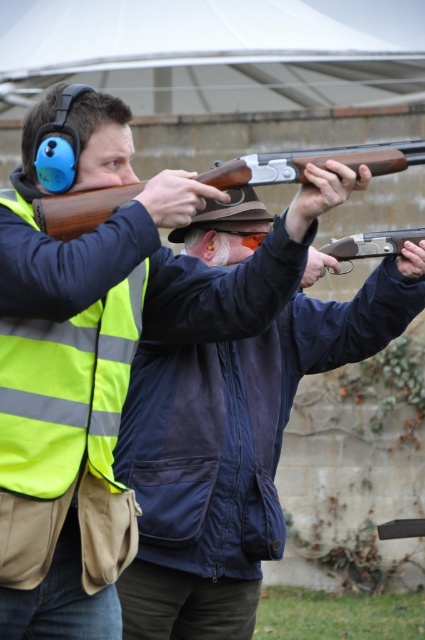
You are a safety officer standing at the shooting range. You see the matte brown shotgun at center. Can you safely retrieve it without entering the danger zone, which extends 25 meters from the firing line?

The matte brown shotgun at center is 28.43 meters away from viewer. Since the danger zone extends 25 meters from the firing line, retrieving it would require entering the danger zone, so it is not safe to retrieve it without proper clearance.

You are a safety officer at a shooting range. You need to ensure that all firearms are at least 6 meters apart for safety regulations. You see the wooden shotgun at center and the matte brown shotgun at upper center. Are they compliant with the safety distance requirement?

The wooden shotgun at center is 5.99 meters away from the matte brown shotgun at upper center. Since the required distance is 6 meters, they are not compliant with the safety distance requirement.

You are a beginner shooter and want to choose a shotgun that is easier to handle. Which one between the matte brown shotgun at center and the wooden shotgun at center should you choose?

The wooden shotgun at center is smaller than the matte brown shotgun at center, so it might be easier to handle for a beginner.